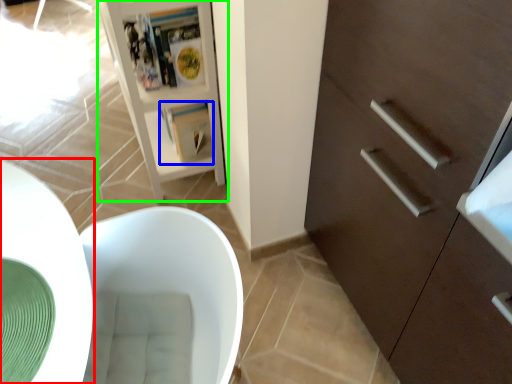
Question: Considering the real-world distances, which object is farthest from round table (highlighted by a red box)? magazine (highlighted by a blue box) or cupboard (highlighted by a green box)?

Choices:
 (A) magazine
 (B) cupboard

Answer: (A)